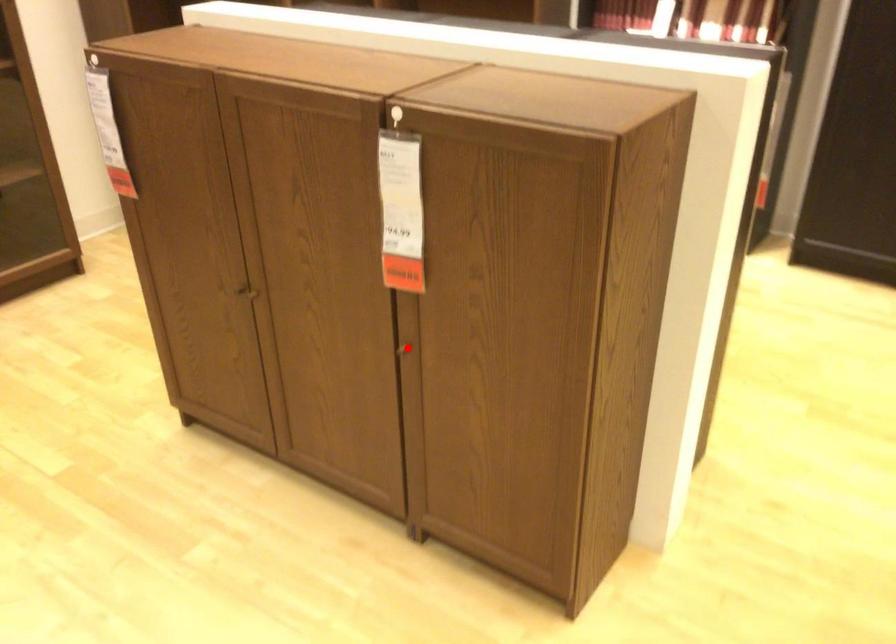
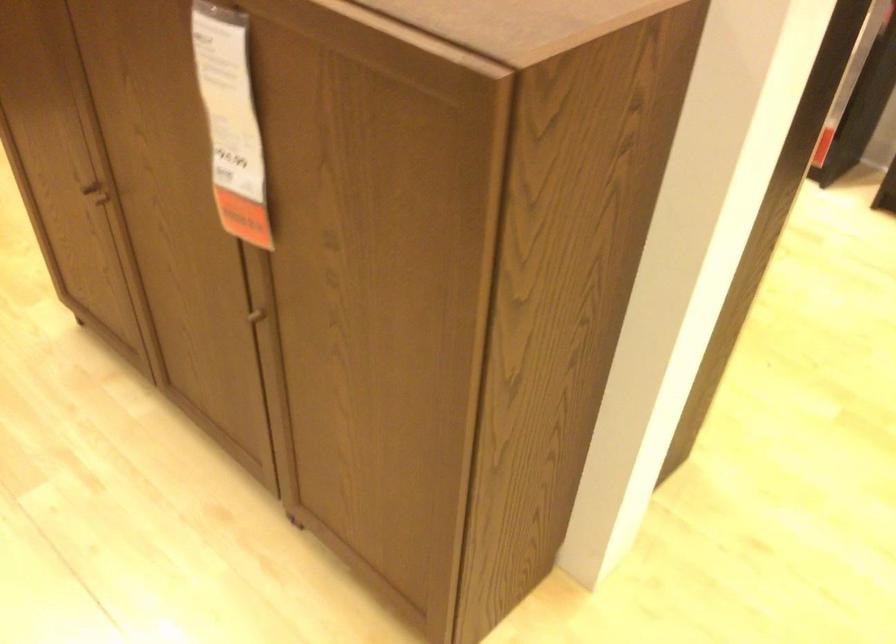
Question: I am providing you with two images of the same scene from different viewpoints. Image1 has a red point marked. In image2, the corresponding 3D location appears at what relative position? Reply with the corresponding letter.

Choices:
 (A) Closer
 (B) Farther

Answer: (A)